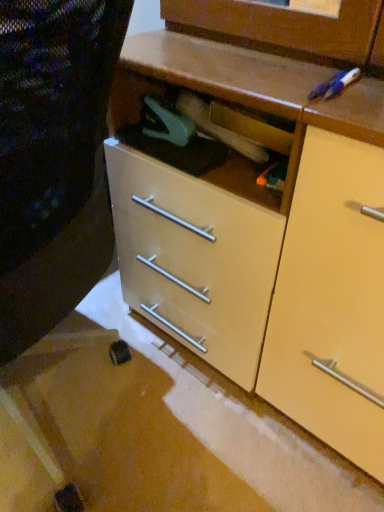
Where is `vacant location below matte black swivel chair at lower left (from a real-world perspective)`? This screenshot has width=384, height=512. vacant location below matte black swivel chair at lower left (from a real-world perspective) is located at coordinates (79, 413).